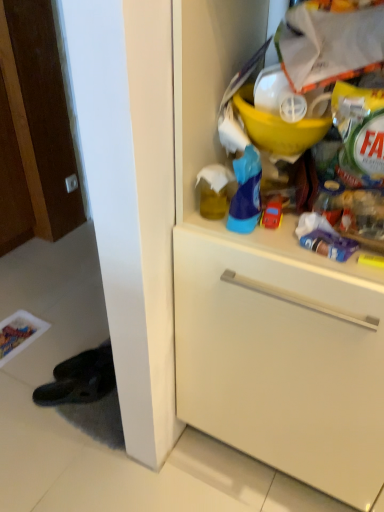
The height and width of the screenshot is (512, 384). What are the coordinates of `red plastic toy car at center` in the screenshot? It's located at (272, 213).

The image size is (384, 512). What do you see at coordinates (272, 213) in the screenshot?
I see `red plastic toy car at center` at bounding box center [272, 213].

In order to face red plastic toy car at center, should I rotate leftwards or rightwards?

To align with it, rotate right about 10.902°.

Image resolution: width=384 pixels, height=512 pixels. Identify the location of white matte cabinet at upper right. (267, 301).

What do you see at coordinates (267, 301) in the screenshot?
I see `white matte cabinet at upper right` at bounding box center [267, 301].

The height and width of the screenshot is (512, 384). I want to click on red plastic toy car at center, so click(x=272, y=213).

Between red plastic toy car at center and white matte cabinet at upper right, which one appears on the right side from the viewer's perspective?

Positioned to the right is white matte cabinet at upper right.

Looking at this image, in the image, is red plastic toy car at center positioned in front of or behind white matte cabinet at upper right?

red plastic toy car at center is behind white matte cabinet at upper right.

Is point (272, 223) behind point (185, 258)?

No, (272, 223) is in front of (185, 258).

From the image's perspective, which object appears higher, red plastic toy car at center or white matte cabinet at upper right?

red plastic toy car at center is shown above in the image.

From a real-world perspective, who is located lower, red plastic toy car at center or white matte cabinet at upper right?

white matte cabinet at upper right.

Which object is wider, red plastic toy car at center or white matte cabinet at upper right?

With larger width is white matte cabinet at upper right.

Can you confirm if red plastic toy car at center is shorter than white matte cabinet at upper right?

Correct, red plastic toy car at center is not as tall as white matte cabinet at upper right.

Considering the relative sizes of red plastic toy car at center and white matte cabinet at upper right in the image provided, is red plastic toy car at center smaller than white matte cabinet at upper right?

Yes.

Is white matte cabinet at upper right surrounded by red plastic toy car at center?

No, white matte cabinet at upper right is not a part of red plastic toy car at center.

Are red plastic toy car at center and white matte cabinet at upper right making contact?

No, red plastic toy car at center is not making contact with white matte cabinet at upper right.

Is white matte cabinet at upper right at the back of red plastic toy car at center?

Absolutely, red plastic toy car at center is directed away from white matte cabinet at upper right.

Can you tell me how much red plastic toy car at center and white matte cabinet at upper right differ in facing direction?

They differ by 0.00529 degrees in their facing directions.

From the picture: Measure the distance from red plastic toy car at center to white matte cabinet at upper right.

They are 13.97 inches apart.

Identify the location of cabinetry in front of the red plastic toy car at center. tap(267, 301).

Considering the positions of objects white matte cabinet at upper right and red plastic toy car at center in the image provided, who is more to the left, white matte cabinet at upper right or red plastic toy car at center?

red plastic toy car at center.

Considering their positions, is white matte cabinet at upper right located in front of or behind red plastic toy car at center?

Visually, white matte cabinet at upper right is located in front of red plastic toy car at center.

Considering the points (212, 226) and (273, 218), which point is behind, point (212, 226) or point (273, 218)?

Positioned behind is point (212, 226).

From the image's perspective, is white matte cabinet at upper right on red plastic toy car at center?

Incorrect, from the image's perspective, white matte cabinet at upper right is lower than red plastic toy car at center.

From a real-world perspective, is white matte cabinet at upper right positioned over red plastic toy car at center based on gravity?

Actually, white matte cabinet at upper right is physically below red plastic toy car at center in the real world.

Consider the image. Which object is wider, white matte cabinet at upper right or red plastic toy car at center?

white matte cabinet at upper right.

Can you confirm if white matte cabinet at upper right is taller than red plastic toy car at center?

Yes.

Considering the sizes of objects white matte cabinet at upper right and red plastic toy car at center in the image provided, who is smaller, white matte cabinet at upper right or red plastic toy car at center?

Smaller between the two is red plastic toy car at center.

Is white matte cabinet at upper right situated inside red plastic toy car at center or outside?

white matte cabinet at upper right is located beyond the bounds of red plastic toy car at center.

Is white matte cabinet at upper right next to red plastic toy car at center?

No, white matte cabinet at upper right is not making contact with red plastic toy car at center.

Is white matte cabinet at upper right facing towards red plastic toy car at center?

Yes, white matte cabinet at upper right faces towards red plastic toy car at center.

How different are the orientations of white matte cabinet at upper right and red plastic toy car at center in degrees?

The angle between the facing direction of white matte cabinet at upper right and the facing direction of red plastic toy car at center is 0.00529 degrees.

How distant is white matte cabinet at upper right from red plastic toy car at center?

They are 13.97 inches apart.

Where is `toy on the left of white matte cabinet at upper right`? toy on the left of white matte cabinet at upper right is located at coordinates (272, 213).

You are a GUI agent. You are given a task and a screenshot of the screen. Output one action in this format:
    pyautogui.click(x=<x>, y=<y>)
    Task: Click on the cabinetry in front of the red plastic toy car at center
    
    Given the screenshot: What is the action you would take?
    pyautogui.click(x=267, y=301)

Find the location of a particular element. This screenshot has width=384, height=512. cabinetry that appears below the red plastic toy car at center (from a real-world perspective) is located at coordinates (267, 301).